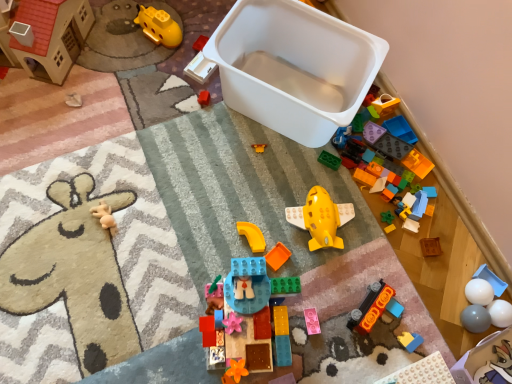
Where is `free area in between matte plastic toy at lower right, which is counted as the 12th toy, starting from the left, and pink matte block at center, the 7th toy from the left`? free area in between matte plastic toy at lower right, which is counted as the 12th toy, starting from the left, and pink matte block at center, the 7th toy from the left is located at coordinates (357, 333).